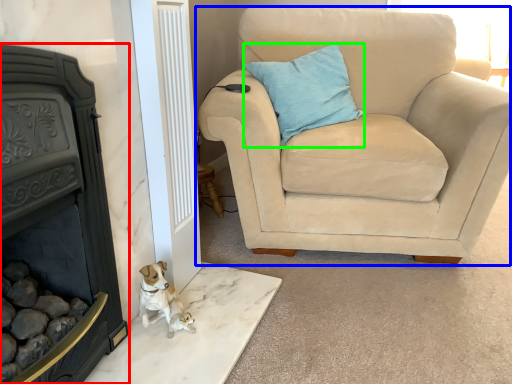
Question: Which is nearer to the fireplace (highlighted by a red box)? chair (highlighted by a blue box) or pillow (highlighted by a green box).

Choices:
 (A) chair
 (B) pillow

Answer: (A)